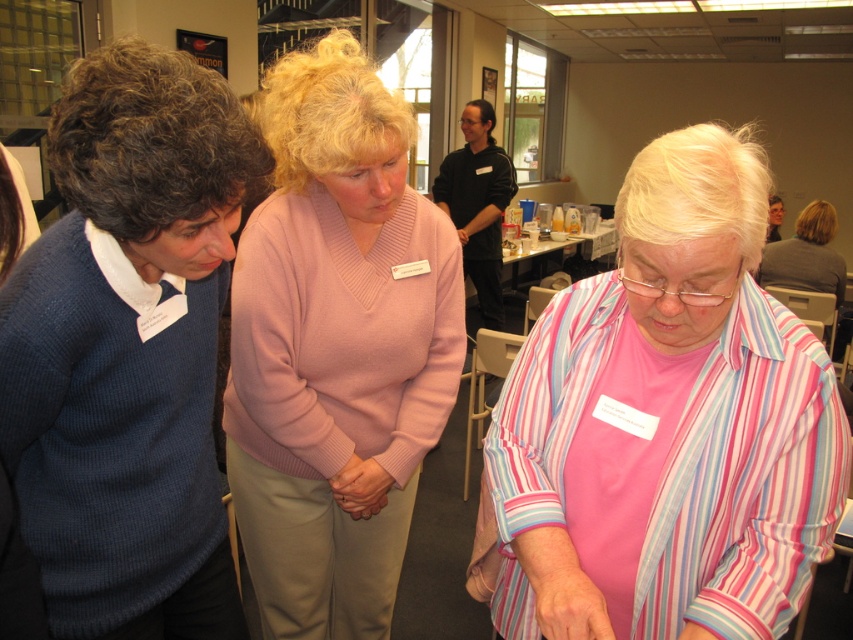
Is dark blue ribbed sweater at left closer to camera compared to pink sweater at center?

Yes, it is in front of pink sweater at center.

Who is more forward, (218, 294) or (328, 301)?

Point (218, 294) is in front.

Where is `dark blue ribbed sweater at left`? dark blue ribbed sweater at left is located at coordinates (128, 349).

In the scene shown: Is pink striped shirt at center thinner than pink sweater at center?

Yes, pink striped shirt at center is thinner than pink sweater at center.

Does point (821, 358) come behind point (381, 300)?

No.

In order to click on pink striped shirt at center in this screenshot , I will do `click(666, 422)`.

Which of these two, pink striped shirt at center or dark blue ribbed sweater at left, stands taller?

Standing taller between the two is dark blue ribbed sweater at left.

Which is behind, point (509, 474) or point (241, 148)?

Positioned behind is point (509, 474).

Between point (519, 448) and point (35, 500), which one is positioned behind?

The point (519, 448) is behind.

The width and height of the screenshot is (853, 640). I want to click on pink striped shirt at center, so click(x=666, y=422).